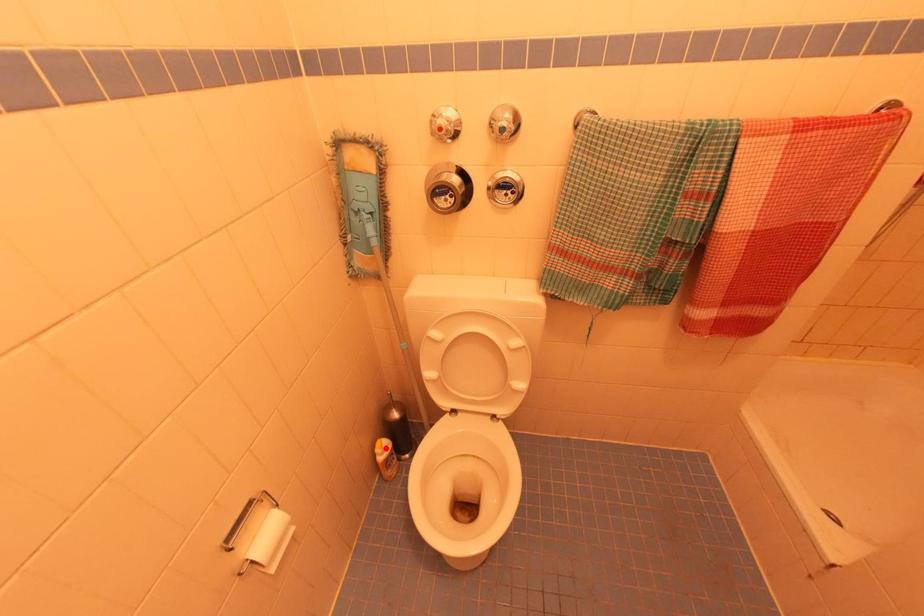
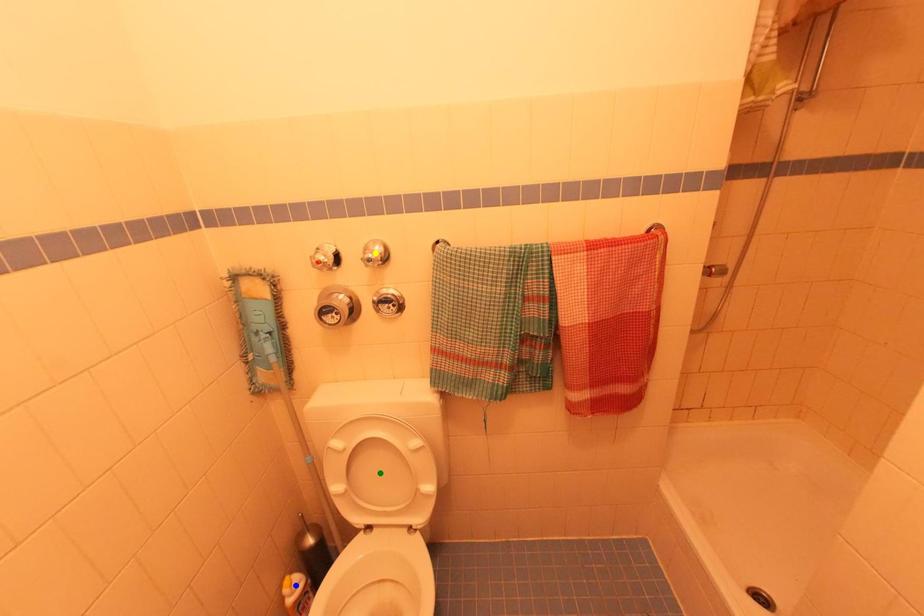
Question: I am providing you with two images of the same scene from different viewpoints. A red point is marked on the first image. You are given multiple points on the second image. Which spot in image 2 lines up with the point in image 1?

Choices:
 (A) blue point
 (B) green point
 (C) yellow point

Answer: (A)